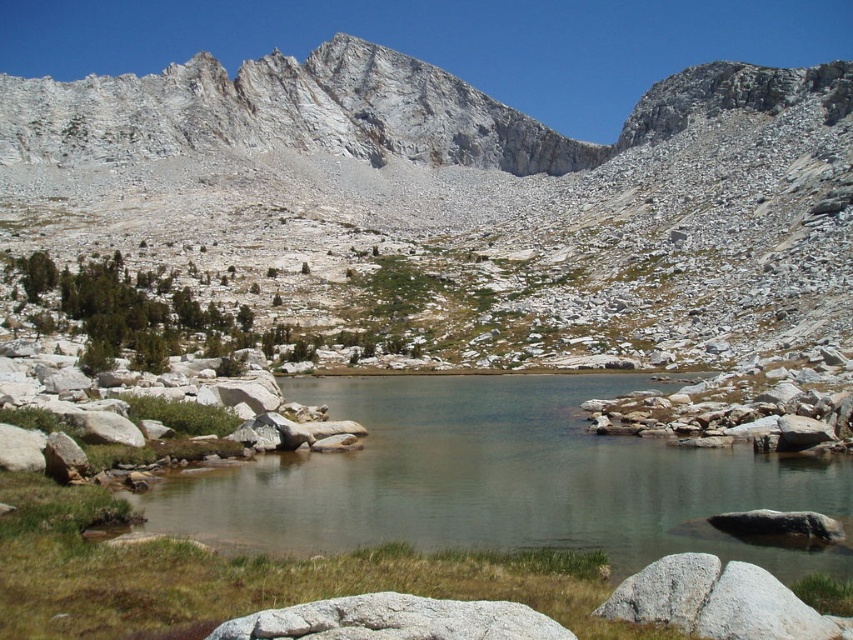
Question: Does white rocky mountain at upper center have a larger size compared to clear water at center?

Choices:
 (A) yes
 (B) no

Answer: (A)

Question: Which of the following is the farthest from the observer?

Choices:
 (A) white rocky mountain at upper center
 (B) clear water at center

Answer: (A)

Question: Which point is farther to the camera?

Choices:
 (A) click(575, 432)
 (B) click(778, 216)

Answer: (B)

Question: Is white rocky mountain at upper center bigger than clear water at center?

Choices:
 (A) yes
 (B) no

Answer: (A)

Question: Is white rocky mountain at upper center in front of clear water at center?

Choices:
 (A) yes
 (B) no

Answer: (B)

Question: Among these points, which one is nearest to the camera?

Choices:
 (A) (752, 106)
 (B) (566, 426)

Answer: (B)